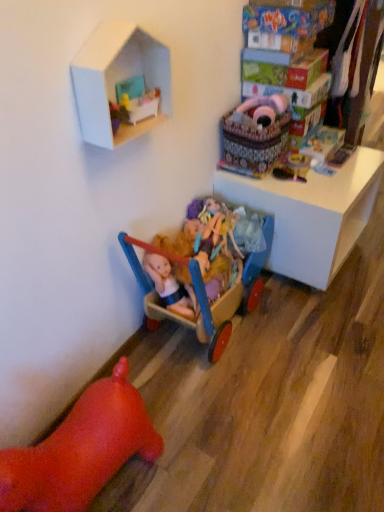
Question: From a real-world perspective, is wooden toy at center, the 2th toy in the right-to-left sequence, positioned above or below velvet pink baby carriage at upper right, the third toy positioned from the right?

Choices:
 (A) above
 (B) below

Answer: (B)

Question: From the image's perspective, is wooden toy at center, the sixth toy viewed from the left, above or below velvet pink baby carriage at upper right, which is counted as the 5th toy, starting from the left?

Choices:
 (A) below
 (B) above

Answer: (A)

Question: Which of these objects is positioned closest to the velvet pink baby carriage at upper right, which is counted as the 5th toy, starting from the left?

Choices:
 (A) rubber pig at lower left, the seventh toy viewed from the right
 (B) wooden toy car at upper right, which ranks as the seventh toy in left-to-right order
 (C) wooden toy at center, the 2th toy in the right-to-left sequence
 (D) wooden wagon at lower center, which is the 5th toy in right-to-left order
 (E) wooden doll carriage at upper center, which is counted as the 4th toy, starting from the right

Answer: (E)

Question: Estimate the real-world distances between objects in this image. Which object is closer to the wooden toy at center, the 2th toy in the right-to-left sequence?

Choices:
 (A) white glossy table at upper right
 (B) wooden doll carriage at upper center, acting as the 4th toy starting from the left
 (C) white cardboard dollhouse at upper center
 (D) velvet pink baby carriage at upper right, the third toy positioned from the right
 (E) wooden doll carriage at center, positioned as the second toy in left-to-right order

Answer: (D)